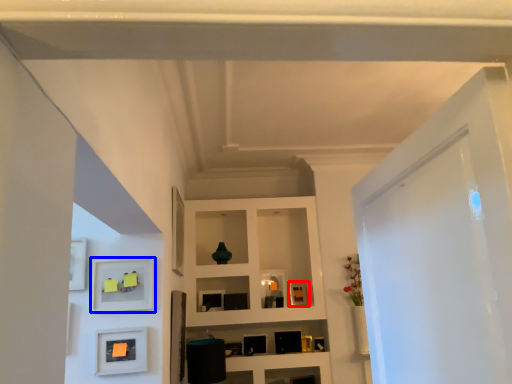
Question: Which object is further to the camera taking this photo, picture frame (highlighted by a red box) or shelf (highlighted by a blue box)?

Choices:
 (A) picture frame
 (B) shelf

Answer: (A)